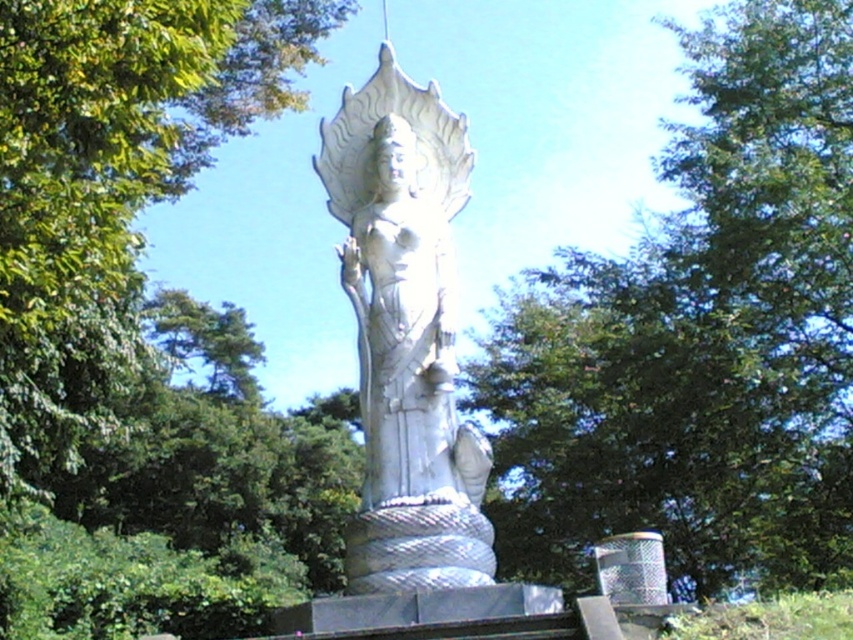
Question: Among these points, which one is nearest to the camera?

Choices:
 (A) (735, 64)
 (B) (339, 216)
 (C) (4, 202)

Answer: (C)

Question: Estimate the real-world distances between objects in this image. Which object is farther from the white stone statue at center?

Choices:
 (A) green leafy tree at center
 (B) green leafy tree at upper left

Answer: (A)

Question: Can you confirm if green leafy tree at center is positioned to the left of white stone statue at center?

Choices:
 (A) yes
 (B) no

Answer: (B)

Question: Observing the image, what is the correct spatial positioning of green leafy tree at center in reference to green leafy tree at upper left?

Choices:
 (A) below
 (B) above

Answer: (B)

Question: Can you confirm if green leafy tree at center is positioned above green leafy tree at upper left?

Choices:
 (A) no
 (B) yes

Answer: (B)

Question: Which point is farther from the camera taking this photo?

Choices:
 (A) (822, 509)
 (B) (424, 336)
 (C) (19, 150)

Answer: (A)